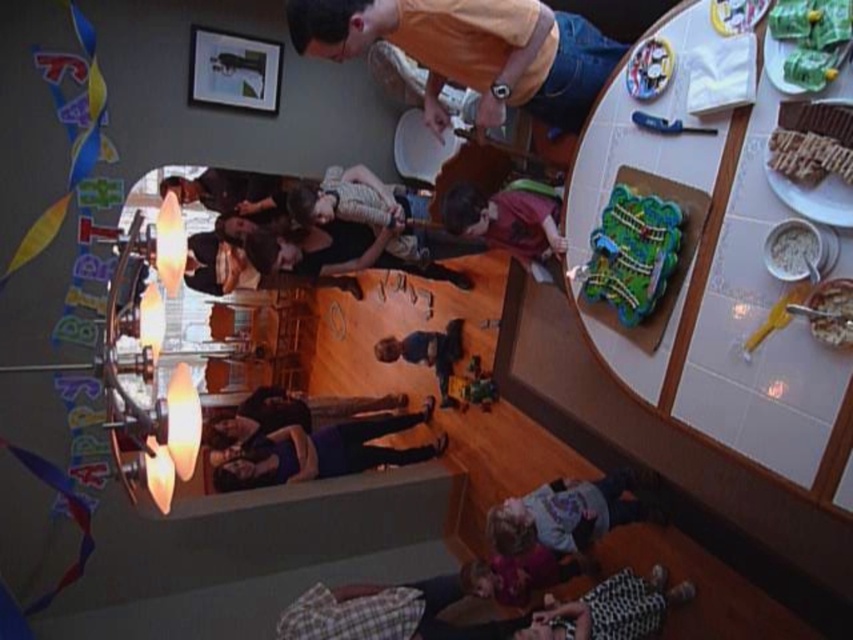
Which is in front, point (502, 230) or point (834, 310)?

Point (834, 310) is more forward.

Between dark red shirt at center and white creamy bowl at lower right, which one has more height?

dark red shirt at center

Where is `dark red shirt at center`? The image size is (853, 640). dark red shirt at center is located at coordinates (506, 220).

The width and height of the screenshot is (853, 640). I want to click on dark red shirt at center, so click(506, 220).

Is point (631, 276) closer to viewer compared to point (590, 621)?

Yes, point (631, 276) is in front of point (590, 621).

Is green plastic train set at center to the right of plaid fabric at lower center from the viewer's perspective?

In fact, green plastic train set at center is to the left of plaid fabric at lower center.

Is point (621, 291) behind point (650, 602)?

No.

Find the location of a particular element. Image resolution: width=853 pixels, height=640 pixels. green plastic train set at center is located at coordinates (631, 253).

Is plaid fabric at lower center below blue fabric shirt at center?

Correct, plaid fabric at lower center is located below blue fabric shirt at center.

From the picture: Can you confirm if plaid fabric at lower center is thinner than blue fabric shirt at center?

In fact, plaid fabric at lower center might be wider than blue fabric shirt at center.

Is point (622, 614) less distant than point (447, 369)?

Yes.

In order to click on plaid fabric at lower center in this screenshot , I will do (x=610, y=609).